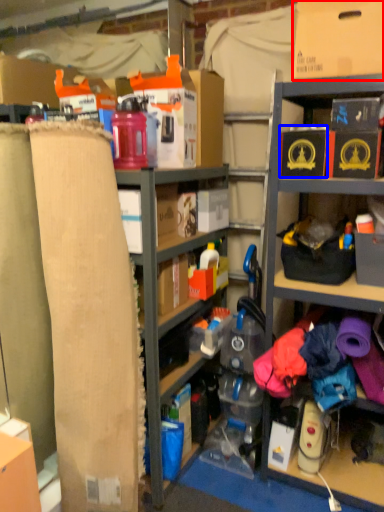
Question: Which object appears closest to the camera in this image, cardboard box (highlighted by a red box) or storage box (highlighted by a blue box)?

Choices:
 (A) cardboard box
 (B) storage box

Answer: (A)